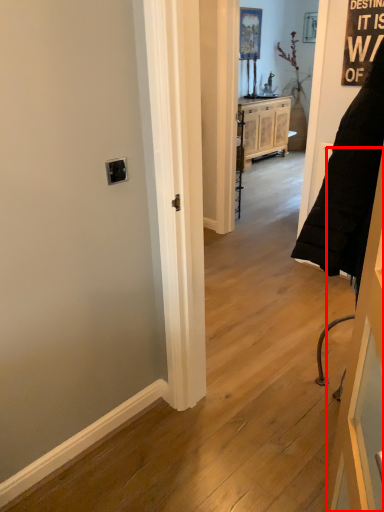
Question: From the image's perspective, what is the correct spatial positioning of door (annotated by the red box) in reference to cabinetry?

Choices:
 (A) below
 (B) above

Answer: (A)